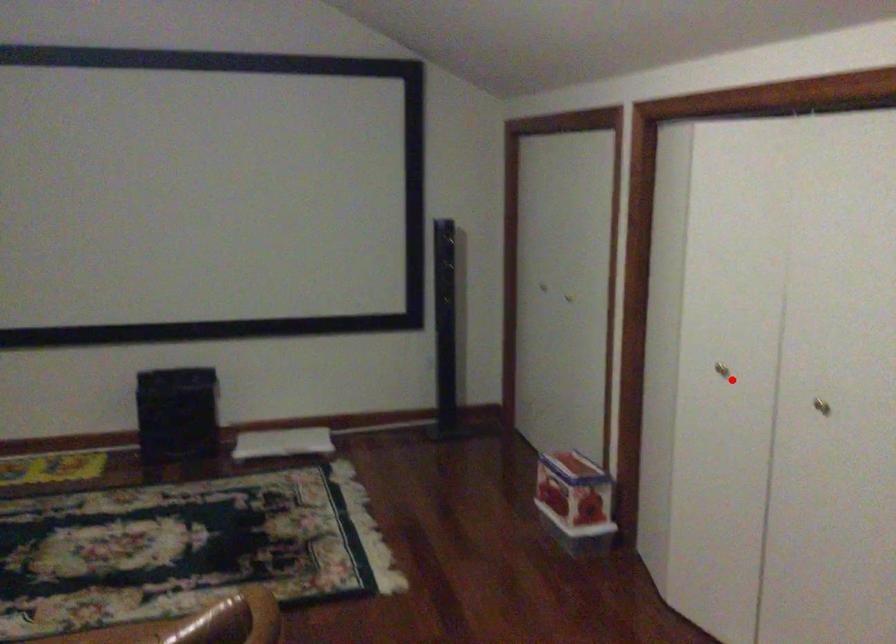
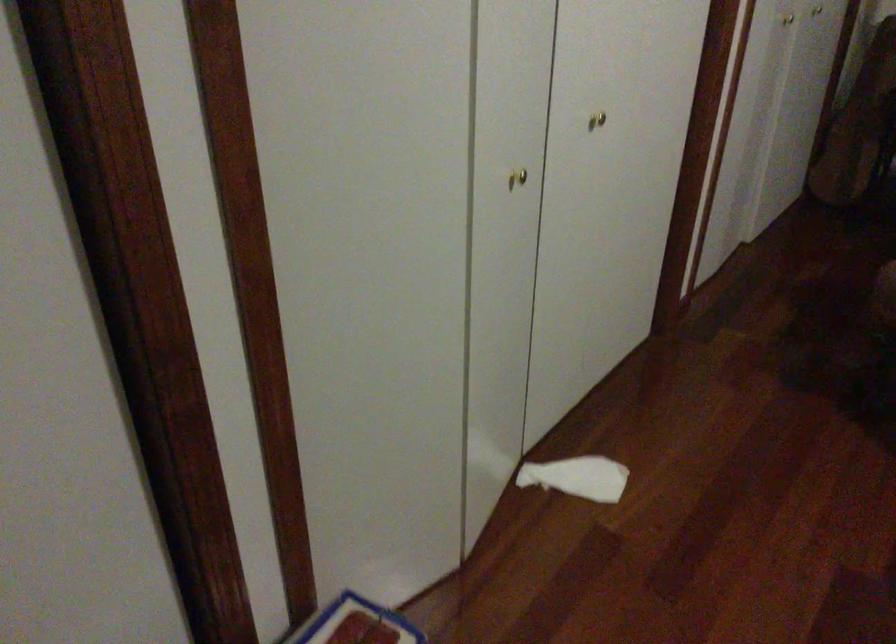
Question: I am providing you with two images of the same scene from different viewpoints. Given a red point in image1, look at the same physical point in image2. Is it:

Choices:
 (A) Closer to the viewpoint
 (B) Farther from the viewpoint

Answer: (A)